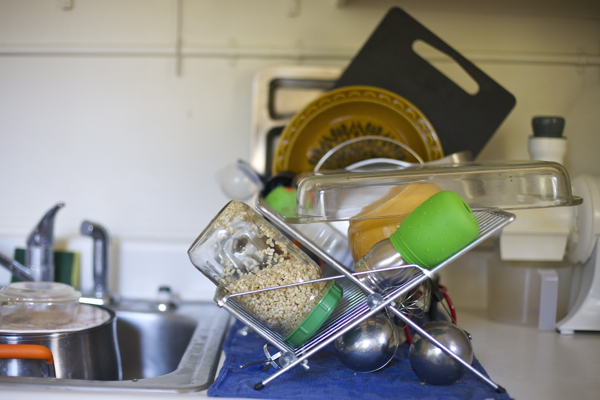
This screenshot has width=600, height=400. Find the location of `cutting board`. cutting board is located at coordinates (476, 120).